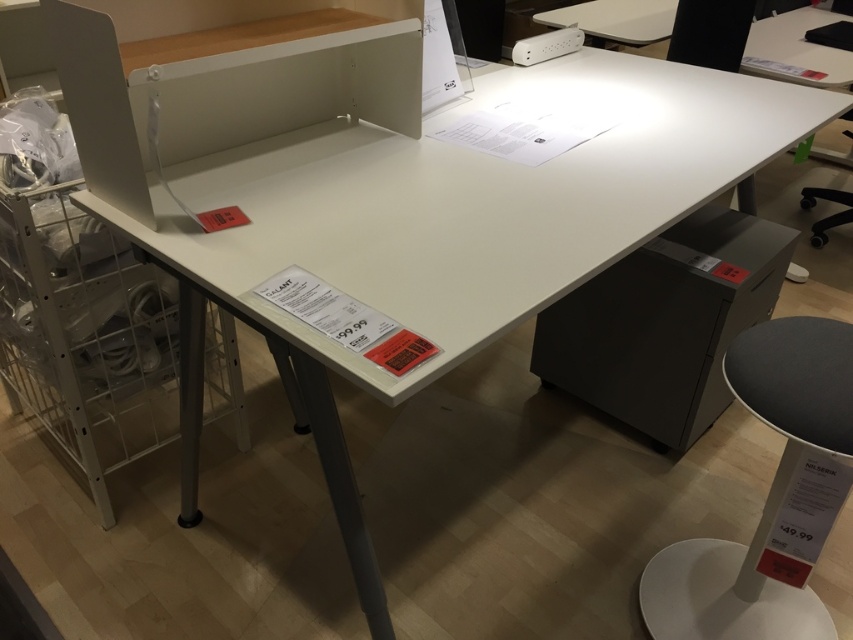
Question: Does white plastic stool at lower right lie behind white plastic power strip at upper center?

Choices:
 (A) yes
 (B) no

Answer: (B)

Question: Which is nearer to the white plastic power strip at upper center?

Choices:
 (A) matte gray drawer at lower right
 (B) white plastic stool at lower right

Answer: (A)

Question: Which of the following is the closest to the observer?

Choices:
 (A) white plastic stool at lower right
 (B) white plastic power strip at upper center
 (C) matte gray drawer at lower right

Answer: (A)

Question: Is matte gray drawer at lower right in front of white plastic power strip at upper center?

Choices:
 (A) yes
 (B) no

Answer: (A)

Question: Which object is farther from the camera taking this photo?

Choices:
 (A) matte gray drawer at lower right
 (B) white plastic stool at lower right

Answer: (A)

Question: Can you confirm if matte gray drawer at lower right is wider than white plastic power strip at upper center?

Choices:
 (A) no
 (B) yes

Answer: (B)